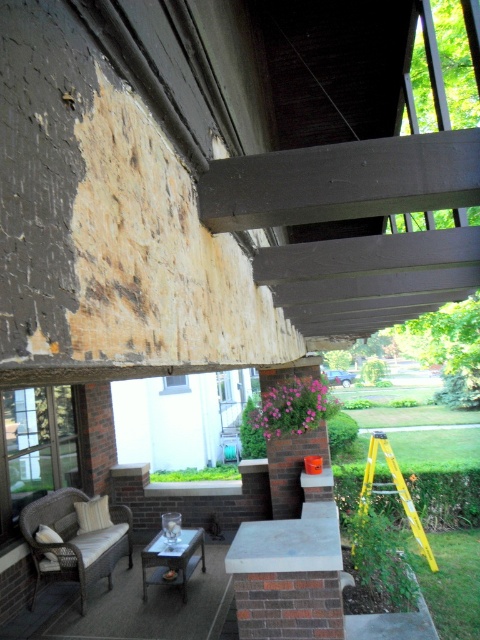
From the picture: Is wicker cushioned chair at lower left thinner than yellow fiberglass ladder at lower right?

Yes, wicker cushioned chair at lower left is thinner than yellow fiberglass ladder at lower right.

Can you confirm if wicker cushioned chair at lower left is positioned to the left of yellow fiberglass ladder at lower right?

Correct, you'll find wicker cushioned chair at lower left to the left of yellow fiberglass ladder at lower right.

Who is more distant from viewer, (124, 516) or (432, 560)?

Point (124, 516)

This screenshot has width=480, height=640. In order to click on wicker cushioned chair at lower left in this screenshot , I will do pyautogui.click(x=74, y=541).